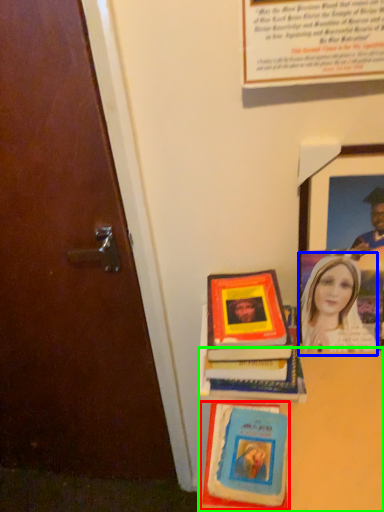
Question: Based on their relative distances, which object is nearer to book cover (highlighted by a red box)? Choose from woman (highlighted by a blue box) and table (highlighted by a green box).

Choices:
 (A) woman
 (B) table

Answer: (B)